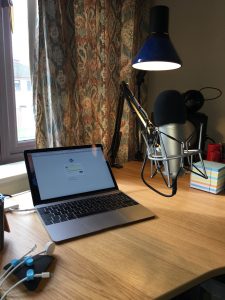
The width and height of the screenshot is (225, 300). I want to click on patterned curtains, so click(88, 108).